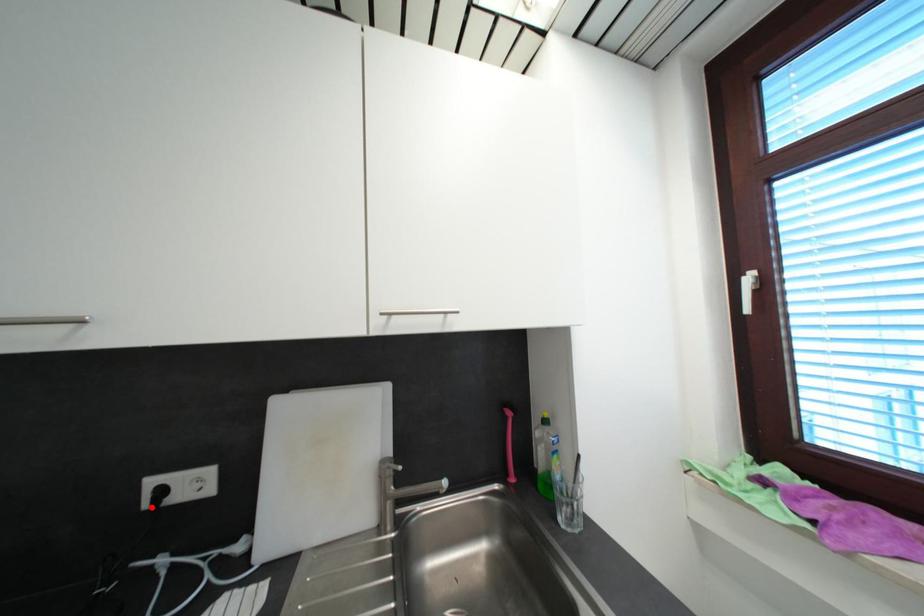
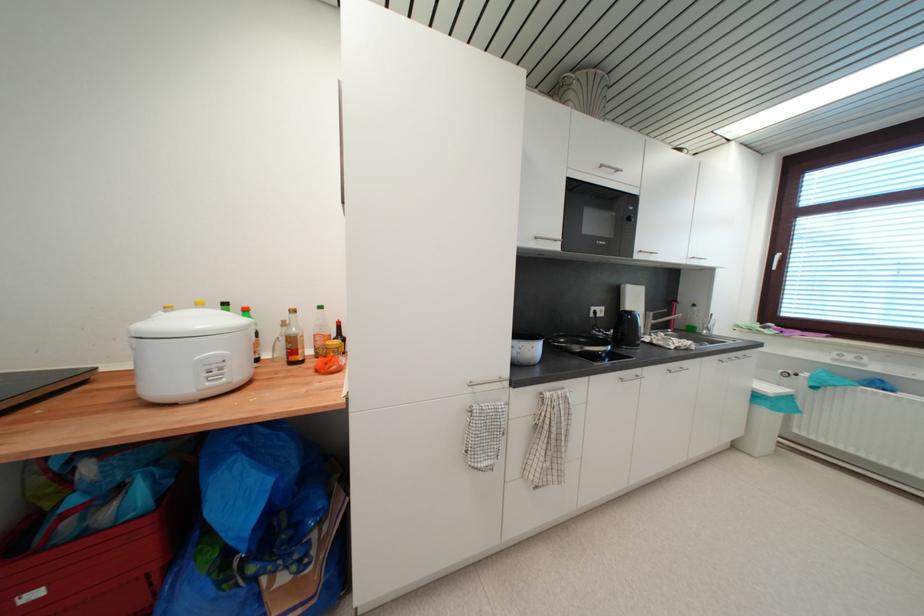
Where in the second image is the point corresponding to the highlighted location from the first image?

(597, 317)